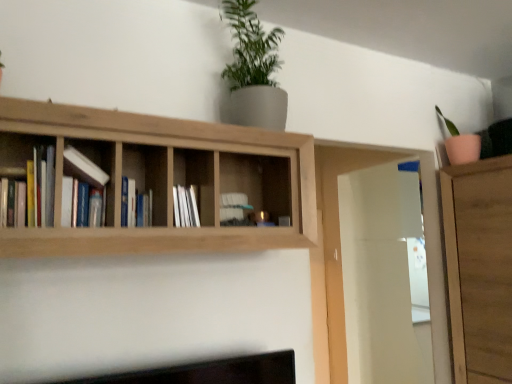
Where is `white glossy cabinet at center`? The height and width of the screenshot is (384, 512). white glossy cabinet at center is located at coordinates (197, 179).

The height and width of the screenshot is (384, 512). What do you see at coordinates (161, 179) in the screenshot?
I see `light brown wood shelf at upper center` at bounding box center [161, 179].

Describe the element at coordinates (135, 205) in the screenshot. I see `blue hardcover book at center, the 2th book when ordered from front to back` at that location.

At what (x,y) coordinates should I click in order to perform the action: click on white glossy cabinet at center. Please return your answer as a coordinate pair (x, y). The image size is (512, 384). Looking at the image, I should click on (197, 179).

From the image's perspective, is white glossy cabinet at center located above or below light brown wood shelf at upper center?

Based on their image positions, white glossy cabinet at center is located beneath light brown wood shelf at upper center.

Considering the sizes of objects white glossy cabinet at center and light brown wood shelf at upper center in the image provided, who is shorter, white glossy cabinet at center or light brown wood shelf at upper center?

white glossy cabinet at center.

Where is `shelf that appears on the left of white glossy cabinet at center`? This screenshot has height=384, width=512. shelf that appears on the left of white glossy cabinet at center is located at coordinates (161, 179).

Which is more to the right, white glossy cabinet at center or light brown wood shelf at upper center?

white glossy cabinet at center is more to the right.

Considering their positions, is white glossy cabinet at center located in front of or behind blue hardcover book at center, the 2th book when ordered from front to back?

Clearly, white glossy cabinet at center is in front of blue hardcover book at center, the 2th book when ordered from front to back.

From the image's perspective, is white glossy cabinet at center located above or below blue hardcover book at center, the 2th book when ordered from front to back?

white glossy cabinet at center is situated lower than blue hardcover book at center, the 2th book when ordered from front to back, in the image.

Is white glossy cabinet at center facing towards blue hardcover book at center, which is counted as the 1th book, starting from the back?

No, white glossy cabinet at center is not oriented towards blue hardcover book at center, which is counted as the 1th book, starting from the back.

Is white glossy cabinet at center bigger or smaller than blue hardcover book at center, the 2th book when ordered from front to back?

white glossy cabinet at center is bigger than blue hardcover book at center, the 2th book when ordered from front to back.

At what (x,y) coordinates should I click in order to perform the action: click on book lying behind the white matte book at center-left, the 1th book positioned from the front. Please return your answer as a coordinate pair (x, y). Image resolution: width=512 pixels, height=384 pixels. Looking at the image, I should click on (135, 205).

Is blue hardcover book at center, the 2th book when ordered from front to back, to the left of white matte book at center-left, the second book in the back-to-front sequence, from the viewer's perspective?

Incorrect, blue hardcover book at center, the 2th book when ordered from front to back, is not on the left side of white matte book at center-left, the second book in the back-to-front sequence.

From the image's perspective, is blue hardcover book at center, the 2th book when ordered from front to back, on top of white matte book at center-left, the second book in the back-to-front sequence?

Actually, blue hardcover book at center, the 2th book when ordered from front to back, appears below white matte book at center-left, the second book in the back-to-front sequence, in the image.

Can you confirm if green matte plant at upper center is shorter than white glossy cabinet at center?

No, green matte plant at upper center is not shorter than white glossy cabinet at center.

At what (x,y) coordinates should I click in order to perform the action: click on cabinet located on the left of green matte plant at upper center. Please return your answer as a coordinate pair (x, y). The image size is (512, 384). Looking at the image, I should click on (197, 179).

From a real-world perspective, who is located lower, green matte plant at upper center or white glossy cabinet at center?

white glossy cabinet at center, from a real-world perspective.

Is green matte plant at upper center facing away from white glossy cabinet at center?

No, white glossy cabinet at center is not at the back of green matte plant at upper center.

Are white glossy cabinet at center and green matte plant at upper center located far from each other?

No.

Is white glossy cabinet at center facing towards green matte plant at upper center?

No, white glossy cabinet at center is not aimed at green matte plant at upper center.

Can you confirm if white glossy cabinet at center is taller than green matte plant at upper center?

No, white glossy cabinet at center is not taller than green matte plant at upper center.

In terms of width, does white glossy cabinet at center look wider or thinner when compared to green matte plant at upper center?

In the image, white glossy cabinet at center appears to be more narrow than green matte plant at upper center.

Between white matte book at center-left, the 1th book positioned from the front, and green matte plant at upper center, which one appears on the left side from the viewer's perspective?

From the viewer's perspective, white matte book at center-left, the 1th book positioned from the front, appears more on the left side.

Considering the sizes of white matte book at center-left, the second book in the back-to-front sequence, and green matte plant at upper center in the image, is white matte book at center-left, the second book in the back-to-front sequence, wider or thinner than green matte plant at upper center?

Clearly, white matte book at center-left, the second book in the back-to-front sequence, has less width compared to green matte plant at upper center.

Is white matte book at center-left, the 1th book positioned from the front, positioned behind green matte plant at upper center?

No, the depth of white matte book at center-left, the 1th book positioned from the front, is less than that of green matte plant at upper center.

From a real-world perspective, is white matte book at center-left, the second book in the back-to-front sequence, physically below green matte plant at upper center?

Yes.

Is green matte plant at upper center touching white matte book at center-left, the 1th book positioned from the front?

green matte plant at upper center is not next to white matte book at center-left, the 1th book positioned from the front, and they're not touching.

From the image's perspective, relative to white matte book at center-left, the second book in the back-to-front sequence, is green matte plant at upper center above or below?

Clearly, from the image's perspective, green matte plant at upper center is above white matte book at center-left, the second book in the back-to-front sequence.

Which object is further away from the camera, green matte plant at upper center or white matte book at center-left, the second book in the back-to-front sequence?

green matte plant at upper center is behind.

From a real-world perspective, which object stands above the other?

green matte plant at upper center is physically above.

Locate an element on the screen. This screenshot has width=512, height=384. cabinet located below the light brown wood shelf at upper center (from the image's perspective) is located at coordinates (197, 179).

Locate an element on the screen. The image size is (512, 384). book behind the white glossy cabinet at center is located at coordinates (135, 205).

Based on their spatial positions, is white glossy cabinet at center or light brown wood shelf at upper center further from blue hardcover book at center, the 2th book when ordered from front to back?

Based on the image, light brown wood shelf at upper center appears to be further to blue hardcover book at center, the 2th book when ordered from front to back.

Based on the photo, estimate the real-world distances between objects in this image. Which object is further from light brown wood shelf at upper center, green matte plant at upper center or blue hardcover book at center, which is counted as the 1th book, starting from the back?

green matte plant at upper center lies further to light brown wood shelf at upper center than the other object.

Estimate the real-world distances between objects in this image. Which object is closer to white matte book at center-left, the 1th book positioned from the front, blue hardcover book at center, the 2th book when ordered from front to back, or white glossy cabinet at center?

blue hardcover book at center, the 2th book when ordered from front to back.

From the image, which object appears to be farther from white matte book at center-left, the 1th book positioned from the front, green matte plant at upper center or blue hardcover book at center, the 2th book when ordered from front to back?

Among the two, green matte plant at upper center is located further to white matte book at center-left, the 1th book positioned from the front.

Which object lies nearer to the anchor point light brown wood shelf at upper center, blue hardcover book at center, which is counted as the 1th book, starting from the back, or white matte book at center-left, the second book in the back-to-front sequence?

blue hardcover book at center, which is counted as the 1th book, starting from the back, is closer to light brown wood shelf at upper center.

Based on their spatial positions, is white glossy cabinet at center or white matte book at center-left, the 1th book positioned from the front, closer to green matte plant at upper center?

white glossy cabinet at center is positioned closer to the anchor green matte plant at upper center.

Estimate the real-world distances between objects in this image. Which object is closer to white matte book at center-left, the 1th book positioned from the front, green matte plant at upper center or light brown wood shelf at upper center?

Among the two, light brown wood shelf at upper center is located nearer to white matte book at center-left, the 1th book positioned from the front.

Which object lies further to the anchor point light brown wood shelf at upper center, white glossy cabinet at center or white matte book at center-left, the 1th book positioned from the front?

The object further to light brown wood shelf at upper center is white matte book at center-left, the 1th book positioned from the front.

Where is `book situated between white matte book at center-left, the 1th book positioned from the front, and white glossy cabinet at center from left to right`? The width and height of the screenshot is (512, 384). book situated between white matte book at center-left, the 1th book positioned from the front, and white glossy cabinet at center from left to right is located at coordinates (135, 205).

At what (x,y) coordinates should I click in order to perform the action: click on cabinet between light brown wood shelf at upper center and blue hardcover book at center, which is counted as the 1th book, starting from the back, from front to back. Please return your answer as a coordinate pair (x, y). The image size is (512, 384). Looking at the image, I should click on (197, 179).

Locate an element on the screen. Image resolution: width=512 pixels, height=384 pixels. shelf situated between white matte book at center-left, the 1th book positioned from the front, and white glossy cabinet at center from left to right is located at coordinates (161, 179).

The width and height of the screenshot is (512, 384). Find the location of `shelf that lies between green matte plant at upper center and white glossy cabinet at center from top to bottom`. shelf that lies between green matte plant at upper center and white glossy cabinet at center from top to bottom is located at coordinates (161, 179).